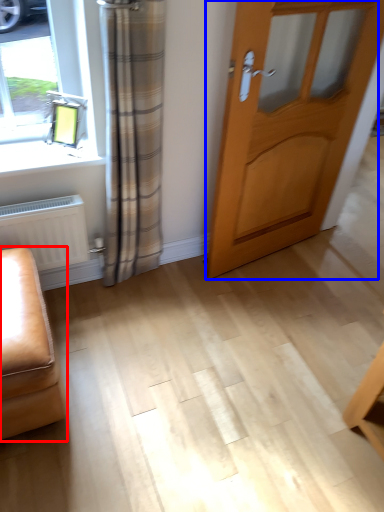
Question: Which of the following is the closest to the observer, furniture (highlighted by a red box) or door (highlighted by a blue box)?

Choices:
 (A) furniture
 (B) door

Answer: (A)